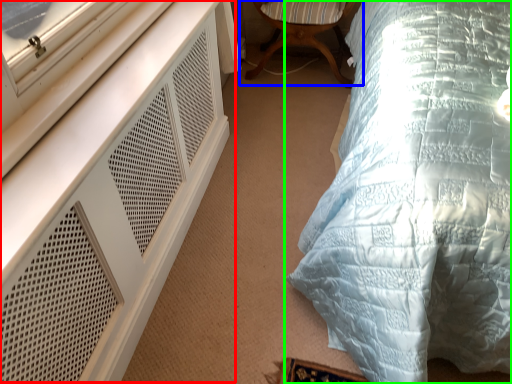
Question: Considering the real-world distances, which object is farthest from dresser (highlighted by a red box)? chair (highlighted by a blue box) or bed (highlighted by a green box)?

Choices:
 (A) chair
 (B) bed

Answer: (A)